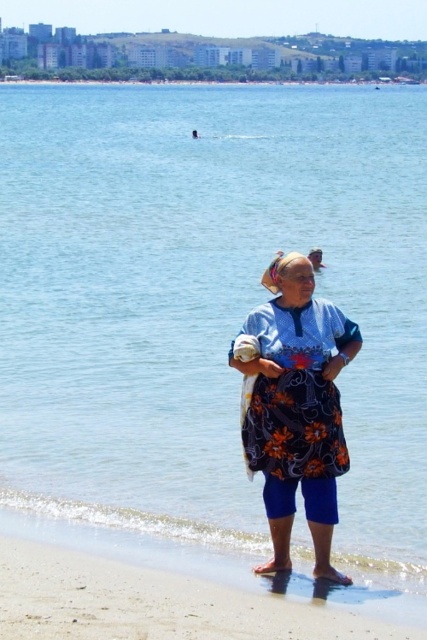
From the picture: You are standing at the shoreline on the beach and see two points marked on the sand. The first point is at coordinates point (x=304, y=605) and the second point is at point (x=330, y=332). Which point is closer to you as you face the ocean?

Point (x=304, y=605) is in front of point (x=330, y=332), so it is closer to you as you face the ocean.